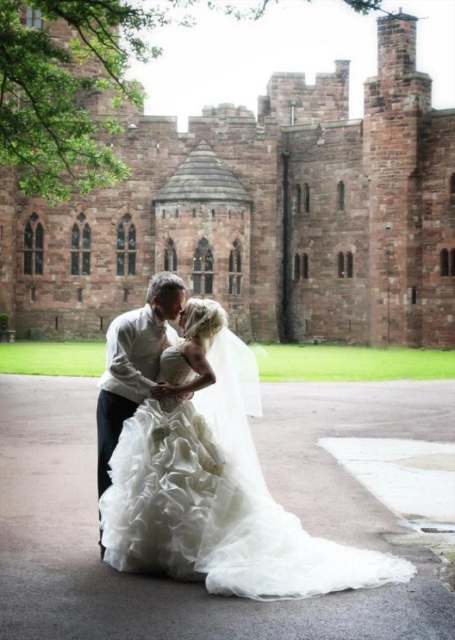
Question: Considering the relative positions of white tulle dress at center and matte white shirt at center in the image provided, where is white tulle dress at center located with respect to matte white shirt at center?

Choices:
 (A) left
 (B) right

Answer: (B)

Question: Which of the following is the farthest from the observer?

Choices:
 (A) (136, 385)
 (B) (242, 349)

Answer: (B)

Question: From the image, what is the correct spatial relationship of white tulle dress at center in relation to matte white shirt at center?

Choices:
 (A) below
 (B) above

Answer: (A)

Question: Is reddish-brown stone castle at center further to camera compared to white tulle dress at center?

Choices:
 (A) yes
 (B) no

Answer: (A)

Question: Which point is farther from the camera taking this photo?

Choices:
 (A) (211, 193)
 (B) (126, 380)
 (C) (242, 381)

Answer: (A)

Question: Which of the following is the farthest from the observer?

Choices:
 (A) matte white shirt at center
 (B) reddish-brown stone castle at center

Answer: (B)